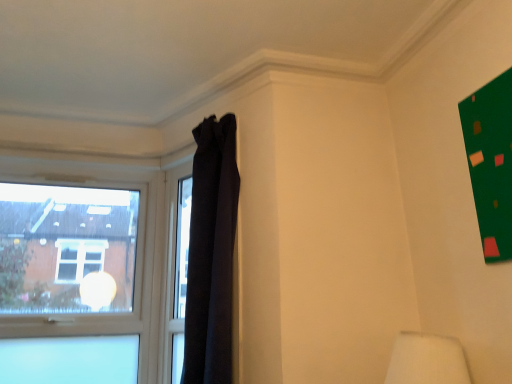
Consider the image. Measure the distance between black fabric curtain at upper center and camera.

black fabric curtain at upper center and camera are 1.62 meters apart from each other.

Describe the element at coordinates (211, 254) in the screenshot. This screenshot has height=384, width=512. I see `black fabric curtain at upper center` at that location.

At what (x,y) coordinates should I click in order to perform the action: click on black fabric curtain at upper center. Please return your answer as a coordinate pair (x, y). This screenshot has height=384, width=512. Looking at the image, I should click on (211, 254).

What do you see at coordinates (87, 280) in the screenshot? I see `transparent glass window at left` at bounding box center [87, 280].

I want to click on transparent glass window at left, so pos(87,280).

Where is `black fabric curtain at upper center`? Image resolution: width=512 pixels, height=384 pixels. black fabric curtain at upper center is located at coordinates (211, 254).

Is transparent glass window at left at the right side of black fabric curtain at upper center?

No, transparent glass window at left is not to the right of black fabric curtain at upper center.

Which object is further away from the camera, transparent glass window at left or black fabric curtain at upper center?

transparent glass window at left is more distant.

Which point is more distant from viewer, (x=4, y=236) or (x=188, y=339)?

Positioned behind is point (x=4, y=236).

From the picture: From the image's perspective, would you say transparent glass window at left is positioned over black fabric curtain at upper center?

No.

From the picture: From a real-world perspective, between transparent glass window at left and black fabric curtain at upper center, who is vertically lower?

In real-world perspective, transparent glass window at left is lower.

Between transparent glass window at left and black fabric curtain at upper center, which one has larger width?

black fabric curtain at upper center.

Does transparent glass window at left have a greater height compared to black fabric curtain at upper center?

No, transparent glass window at left is not taller than black fabric curtain at upper center.

Consider the image. Considering the sizes of objects transparent glass window at left and black fabric curtain at upper center in the image provided, who is smaller, transparent glass window at left or black fabric curtain at upper center?

With smaller size is transparent glass window at left.

Is black fabric curtain at upper center inside transparent glass window at left?

Actually, black fabric curtain at upper center is outside transparent glass window at left.

Is transparent glass window at left beside black fabric curtain at upper center?

No, transparent glass window at left is not touching black fabric curtain at upper center.

Is transparent glass window at left oriented towards black fabric curtain at upper center?

No, transparent glass window at left is not aimed at black fabric curtain at upper center.

Measure the distance between transparent glass window at left and black fabric curtain at upper center.

transparent glass window at left is 28.98 inches away from black fabric curtain at upper center.

Where is `curtain that appears on the right of transparent glass window at left`? The width and height of the screenshot is (512, 384). curtain that appears on the right of transparent glass window at left is located at coordinates (211, 254).

Which object is positioned more to the right, black fabric curtain at upper center or transparent glass window at left?

black fabric curtain at upper center is more to the right.

Is black fabric curtain at upper center further to camera compared to transparent glass window at left?

That is False.

Which is more distant, (194, 301) or (129, 206)?

Point (129, 206)

From the image's perspective, is black fabric curtain at upper center located beneath transparent glass window at left?

No.

From a real-world perspective, which is physically above, black fabric curtain at upper center or transparent glass window at left?

From a 3D spatial view, black fabric curtain at upper center is above.

Looking at this image, is black fabric curtain at upper center thinner than transparent glass window at left?

Incorrect, the width of black fabric curtain at upper center is not less than that of transparent glass window at left.

Who is taller, black fabric curtain at upper center or transparent glass window at left?

black fabric curtain at upper center.

Is black fabric curtain at upper center bigger than transparent glass window at left?

Indeed, black fabric curtain at upper center has a larger size compared to transparent glass window at left.

Would you say black fabric curtain at upper center is outside transparent glass window at left?

Yes, black fabric curtain at upper center is outside of transparent glass window at left.

Can you see black fabric curtain at upper center touching transparent glass window at left?

No, black fabric curtain at upper center is not with transparent glass window at left.

Is black fabric curtain at upper center oriented away from transparent glass window at left?

No, black fabric curtain at upper center is not facing away from transparent glass window at left.

What's the angular difference between black fabric curtain at upper center and transparent glass window at left's facing directions?

The angle between the facing direction of black fabric curtain at upper center and the facing direction of transparent glass window at left is 59.1 degrees.

How much distance is there between black fabric curtain at upper center and transparent glass window at left?

black fabric curtain at upper center and transparent glass window at left are 28.98 inches apart from each other.

You are a GUI agent. You are given a task and a screenshot of the screen. Output one action in this format:
    pyautogui.click(x=<x>, y=<y>)
    Task: Click on the curtain above the transparent glass window at left (from a real-world perspective)
    This screenshot has width=512, height=384.
    Given the screenshot: What is the action you would take?
    pyautogui.click(x=211, y=254)

Find the location of a particular element. Image resolution: width=512 pixels, height=384 pixels. curtain above the transparent glass window at left (from a real-world perspective) is located at coordinates (211, 254).

Where is `curtain on the right of transparent glass window at left`? Image resolution: width=512 pixels, height=384 pixels. curtain on the right of transparent glass window at left is located at coordinates click(211, 254).